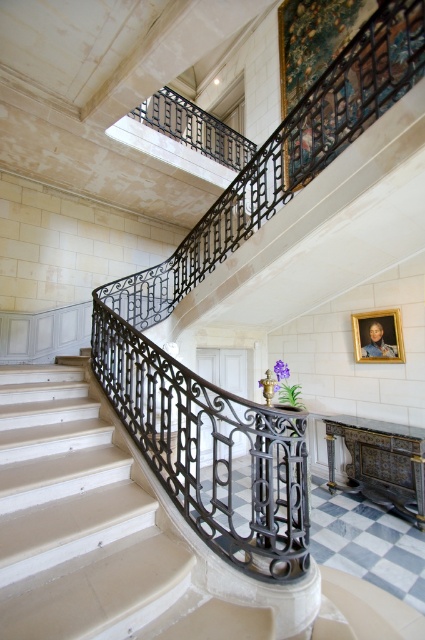
Which is in front, point (187, 518) or point (362, 349)?

Positioned in front is point (187, 518).

Who is more distant from viewer, (265, 564) or (376, 349)?

The point (376, 349) is more distant.

Does point (291, 484) lie in front of point (373, 337)?

Yes.

What are the coordinates of `black wrought iron railing at center` in the screenshot? It's located at (209, 451).

Which of these two, polished marble stairs at center or gold-framed portrait at upper center, stands shorter?

gold-framed portrait at upper center

Measure the distance between polished marble stairs at center and gold-framed portrait at upper center.

polished marble stairs at center is 10.54 feet away from gold-framed portrait at upper center.

Between point (8, 388) and point (359, 332), which one is positioned in front?

Positioned in front is point (8, 388).

At what (x,y) coordinates should I click in order to perform the action: click on polished marble stairs at center. Please return your answer as a coordinate pair (x, y). Looking at the image, I should click on (101, 524).

Is point (223, 570) less distant than point (195, 378)?

Yes, point (223, 570) is closer to viewer.

Is polished marble stairs at center wider than black wrought iron railing at center?

Correct, the width of polished marble stairs at center exceeds that of black wrought iron railing at center.

Which is behind, point (130, 502) or point (93, 342)?

The point (93, 342) is more distant.

Identify the location of polished marble stairs at center. (101, 524).